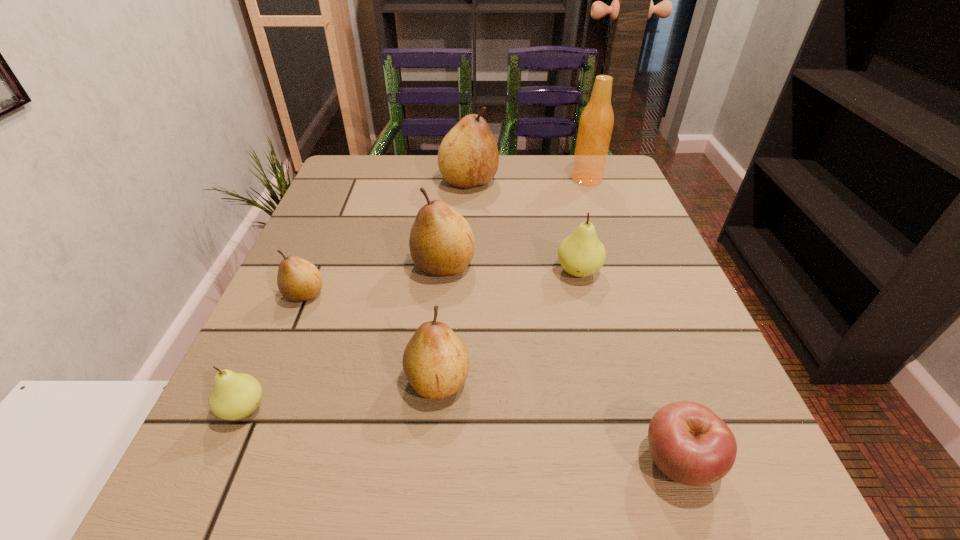
Locate an element on the screen. the nearer green pear is located at coordinates (234, 396).

What are the coordinates of `the smaller green pear` in the screenshot? It's located at (234, 396).

Locate an element on the screen. apple is located at coordinates (689, 443).

Image resolution: width=960 pixels, height=540 pixels. I want to click on vacant position located on the back of the tallest object, so click(x=580, y=160).

Identify the location of vacant space located on the front of the biggest brown pear. (468, 224).

The image size is (960, 540). I want to click on vacant space situated 0.240m on the right of the fifth shortest pear, so click(596, 265).

The image size is (960, 540). In order to click on vacant space located 0.100m on the front of the right green pear in this screenshot , I will do `click(592, 327)`.

The width and height of the screenshot is (960, 540). What are the coordinates of `vacant space situated 0.200m on the right of the second smallest brown pear` in the screenshot? It's located at (601, 380).

You are a GUI agent. You are given a task and a screenshot of the screen. Output one action in this format:
    pyautogui.click(x=<x>, y=<y>)
    Task: Click on the vacant space located 0.180m on the front of the leftmost brown pear
    The width and height of the screenshot is (960, 540).
    Given the screenshot: What is the action you would take?
    pyautogui.click(x=261, y=396)

The height and width of the screenshot is (540, 960). Find the location of `vacant area situated 0.050m on the back of the smaller green pear`. vacant area situated 0.050m on the back of the smaller green pear is located at coordinates (265, 362).